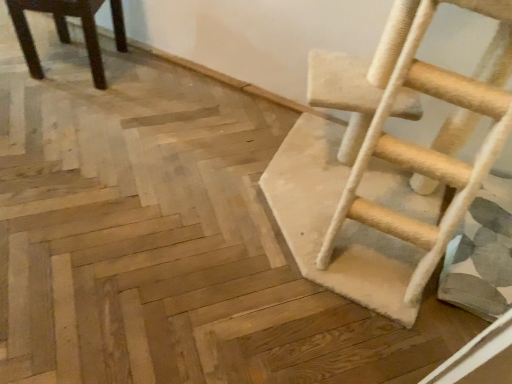
Question: Considering the relative sizes of dark brown wood chair at upper left and beige carpeted ladder at right in the image provided, is dark brown wood chair at upper left thinner than beige carpeted ladder at right?

Choices:
 (A) yes
 (B) no

Answer: (A)

Question: Is dark brown wood chair at upper left to the right of beige carpeted ladder at right from the viewer's perspective?

Choices:
 (A) yes
 (B) no

Answer: (B)

Question: Is dark brown wood chair at upper left wider than beige carpeted ladder at right?

Choices:
 (A) yes
 (B) no

Answer: (B)

Question: Considering the relative sizes of dark brown wood chair at upper left and beige carpeted ladder at right in the image provided, is dark brown wood chair at upper left taller than beige carpeted ladder at right?

Choices:
 (A) yes
 (B) no

Answer: (B)

Question: Can we say dark brown wood chair at upper left lies outside beige carpeted ladder at right?

Choices:
 (A) no
 (B) yes

Answer: (B)

Question: Does dark brown wood chair at upper left contain beige carpeted ladder at right?

Choices:
 (A) yes
 (B) no

Answer: (B)

Question: Considering the relative sizes of beige carpeted ladder at right and dark brown wood chair at upper left in the image provided, is beige carpeted ladder at right thinner than dark brown wood chair at upper left?

Choices:
 (A) no
 (B) yes

Answer: (A)

Question: Can you confirm if beige carpeted ladder at right is positioned to the right of dark brown wood chair at upper left?

Choices:
 (A) no
 (B) yes

Answer: (B)

Question: Is beige carpeted ladder at right facing towards dark brown wood chair at upper left?

Choices:
 (A) yes
 (B) no

Answer: (B)

Question: Is beige carpeted ladder at right closer to camera compared to dark brown wood chair at upper left?

Choices:
 (A) no
 (B) yes

Answer: (B)

Question: From the image's perspective, would you say beige carpeted ladder at right is shown under dark brown wood chair at upper left?

Choices:
 (A) yes
 (B) no

Answer: (A)

Question: Is beige carpeted ladder at right positioned with its back to dark brown wood chair at upper left?

Choices:
 (A) no
 (B) yes

Answer: (A)

Question: In the image, is beige carpeted ladder at right positioned in front of or behind dark brown wood chair at upper left?

Choices:
 (A) behind
 (B) front

Answer: (B)